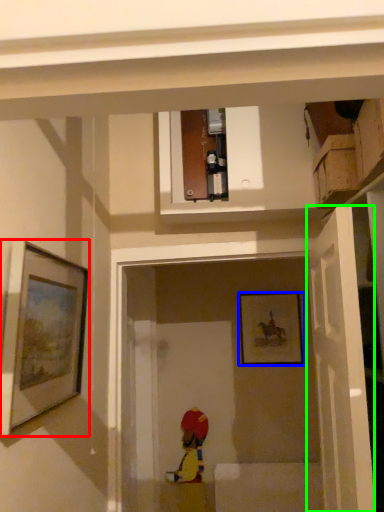
Question: Which object is the closest to the picture frame (highlighted by a red box)? Choose among these: picture frame (highlighted by a blue box) or door (highlighted by a green box).

Choices:
 (A) picture frame
 (B) door

Answer: (B)